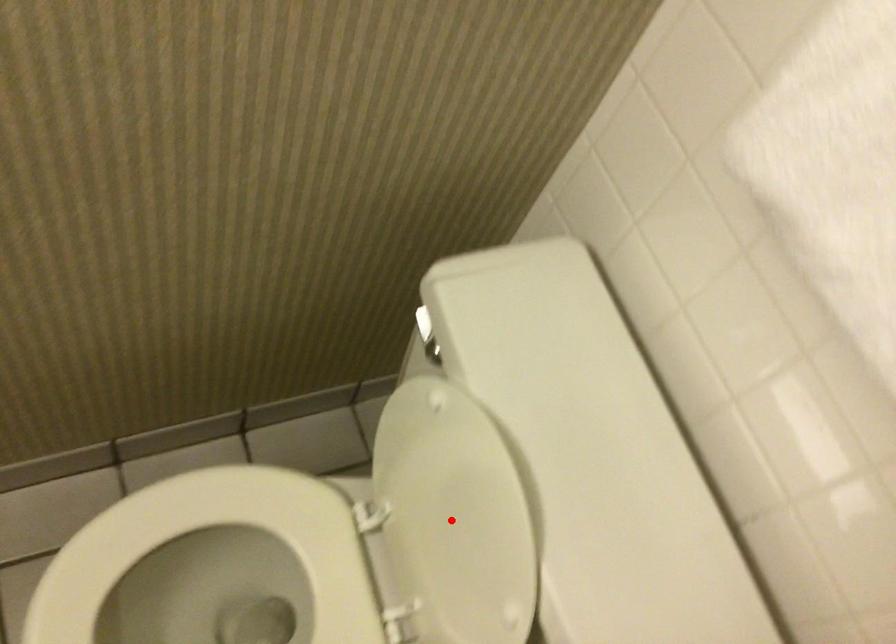
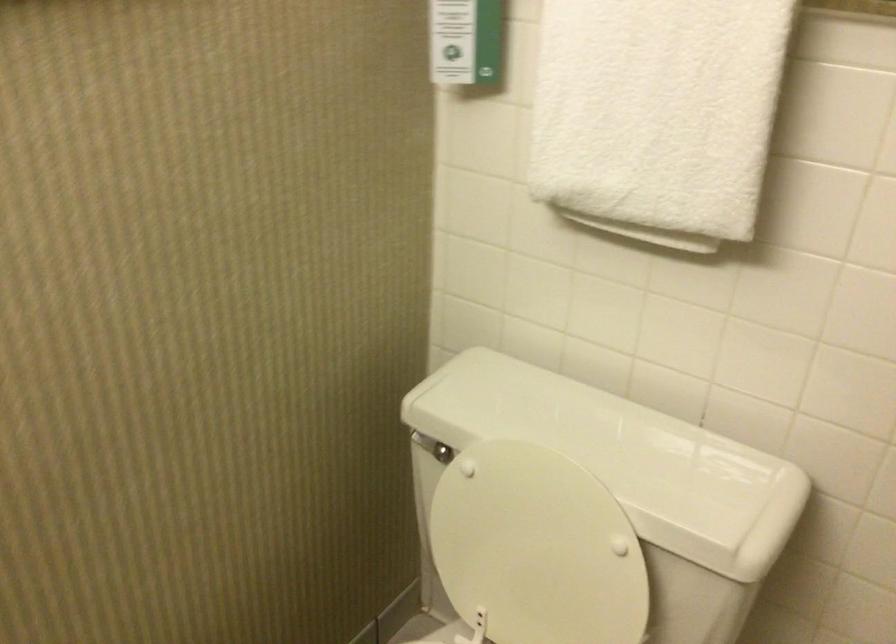
The point at the highlighted location is marked in the first image. Where is the corresponding point in the second image?

(536, 547)